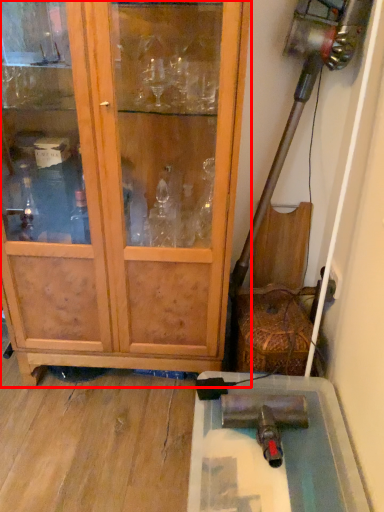
Question: In this image, where is cupboard (annotated by the red box) located relative to cabinetry?

Choices:
 (A) right
 (B) left

Answer: (B)